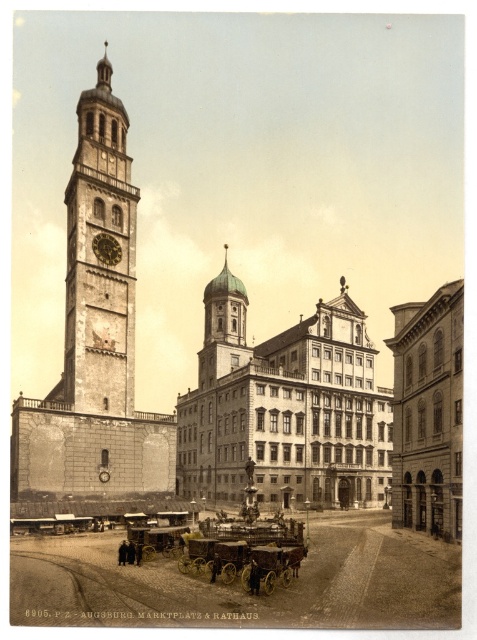
You are standing at the point closest to the front of the image. Which of the two points, point (352, 417) or point (112, 237), is farther away from you?

Point (352, 417) is farther away from you because it is behind point (112, 237).